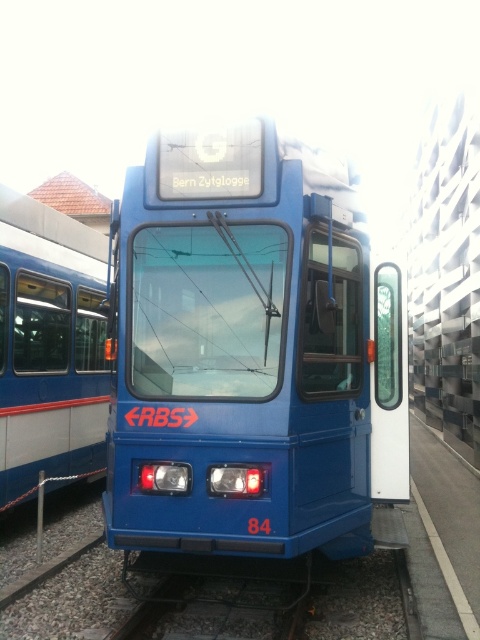
Consider the image. You are a city planner analyzing tram routes. You observe the blue matte train at center and the blue painted metal passenger train at left. Which tram is more likely to be the main service vehicle for the city based on their sizes?

The blue matte train at center is larger in size compared to the blue painted metal passenger train at left, making it more likely to be the main service vehicle for the city.

You are a passenger waiting at the station and see the blue matte train at center and the blue painted metal passenger train at left. Which train is positioned higher from the ground?

The blue matte train at center is positioned higher from the ground than the blue painted metal passenger train at left because it is above it.

You are a passenger trying to board the tram. You see the blue matte train at center and the blue painted metal passenger train at left. Which tram is shorter in height?

The blue matte train at center has a lesser height compared to the blue painted metal passenger train at left, so the blue matte train at center is shorter in height.